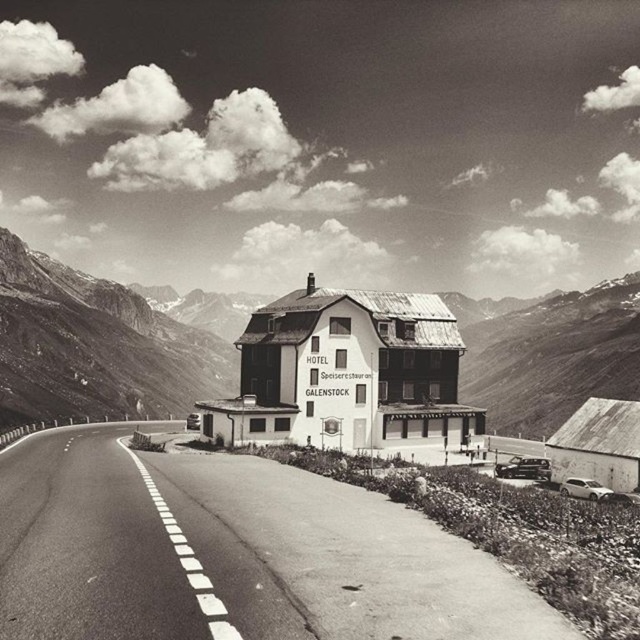
You are a hiker planning to reach the rugged stone mountain at center from the asphalt road at center. Based on the scene, which direction should you head relative to the road?

The asphalt road at center is located below rugged stone mountain at center, so you should head upwards from the asphalt road at center to reach the rugged stone mountain at center.